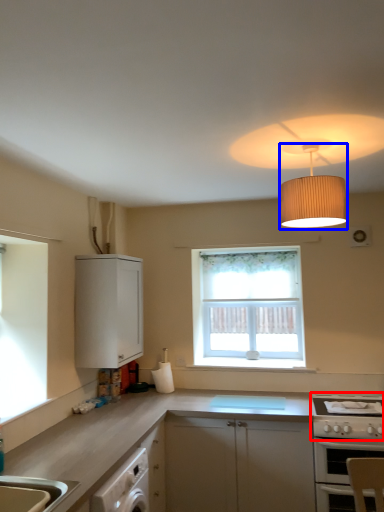
Question: Which object is closer to the camera taking this photo, gas stove (highlighted by a red box) or lamp (highlighted by a blue box)?

Choices:
 (A) gas stove
 (B) lamp

Answer: (B)